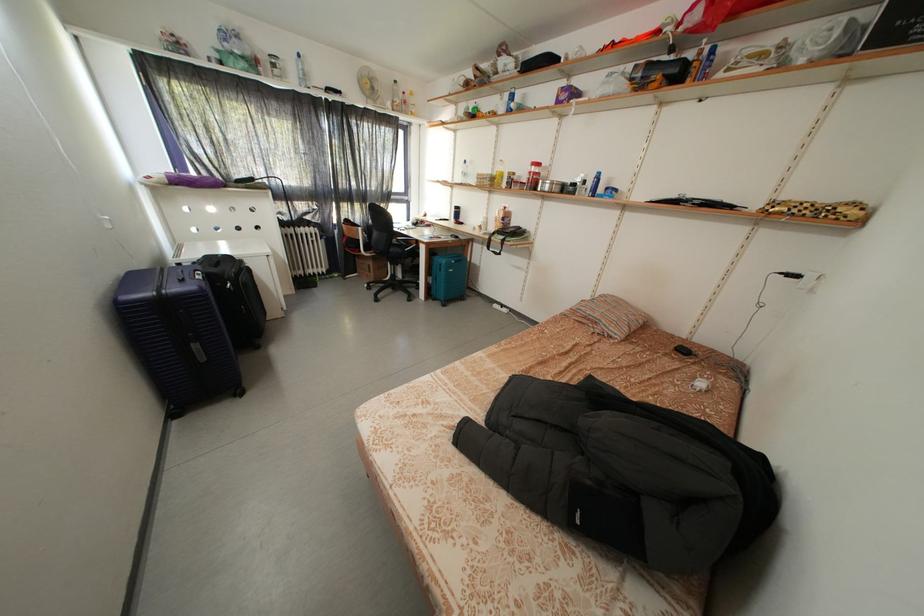
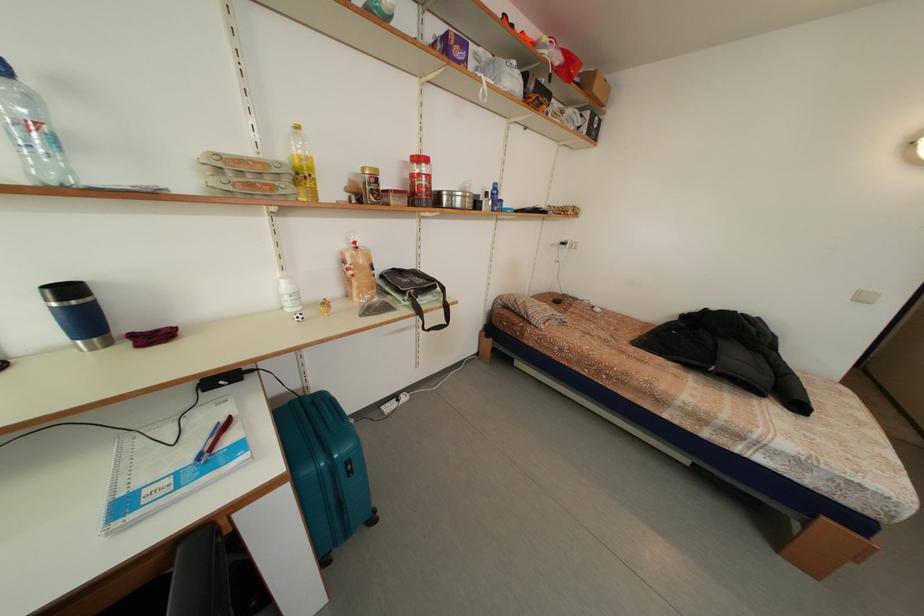
In the second image, find the point that corresponds to point 475,172 in the first image.

(40, 106)